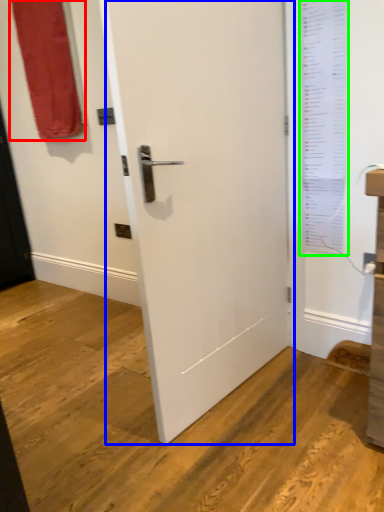
Question: Which object is positioned closest to curtain (highlighted by a red box)? Select from door (highlighted by a blue box) and window screen (highlighted by a green box).

Choices:
 (A) door
 (B) window screen

Answer: (A)